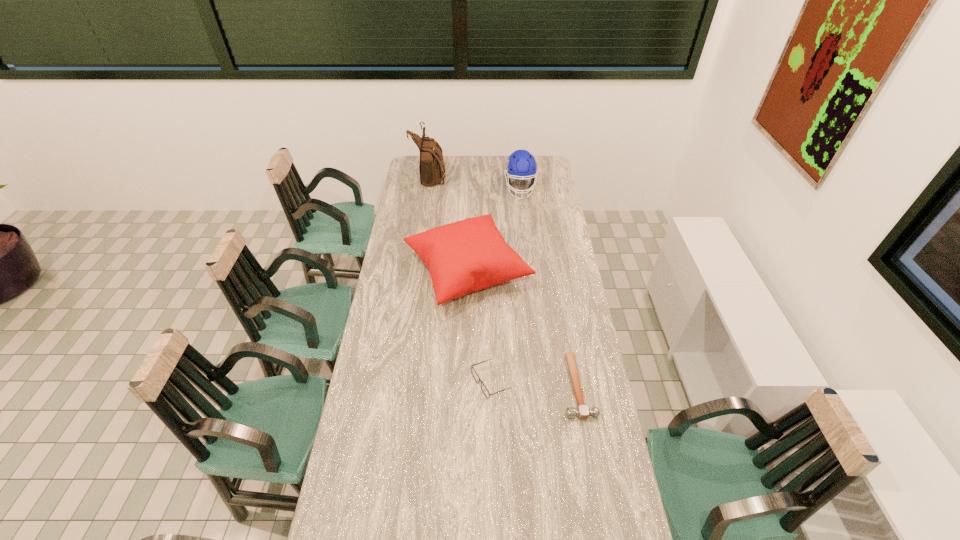
Identify the location of shoulder bag. Image resolution: width=960 pixels, height=540 pixels. (431, 166).

The image size is (960, 540). I want to click on football helmet, so click(x=520, y=164).

In order to click on the third nearest object in this screenshot , I will do `click(466, 256)`.

This screenshot has width=960, height=540. I want to click on the second shortest object, so click(x=474, y=373).

Where is `the shortest object`? The image size is (960, 540). the shortest object is located at coordinates [x=582, y=412].

The width and height of the screenshot is (960, 540). Identify the location of free space located on the front-facing side of the tallest object. 499,175.

This screenshot has height=540, width=960. In order to click on free region located on the face guard of the football helmet in this screenshot , I will do pyautogui.click(x=523, y=215).

This screenshot has height=540, width=960. Identify the location of vacant point located on the front of the cushion. (x=465, y=352).

Locate an element on the screen. This screenshot has width=960, height=540. vacant region located with the lenses facing outward on the second shortest object is located at coordinates (437, 382).

Identify the location of vacant space located with the lenses facing outward on the second shortest object. (386, 382).